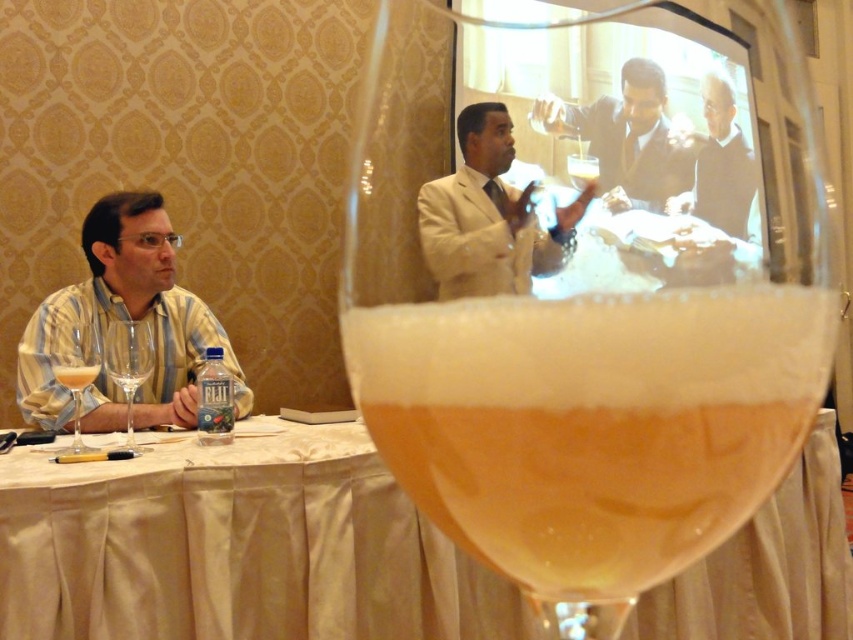
Who is shorter, yellow striped shirt at left or blue plastic water at lower center?

Standing shorter between the two is blue plastic water at lower center.

Who is lower down, yellow striped shirt at left or blue plastic water at lower center?

blue plastic water at lower center is below.

Does point (192, 332) come behind point (212, 410)?

Yes, it is.

The width and height of the screenshot is (853, 640). Identify the location of yellow striped shirt at left. (126, 317).

Does point (152, 273) come behind point (750, 164)?

Yes, it is.

Who is more distant from viewer, (33, 353) or (737, 224)?

The point (33, 353) is more distant.

The image size is (853, 640). Identify the location of yellow striped shirt at left. (126, 317).

Based on the photo, does clear glass wine glass at center appear on the right side of blue plastic water at lower center?

Yes, clear glass wine glass at center is to the right of blue plastic water at lower center.

Where is `clear glass wine glass at center`? Image resolution: width=853 pixels, height=640 pixels. clear glass wine glass at center is located at coordinates (596, 349).